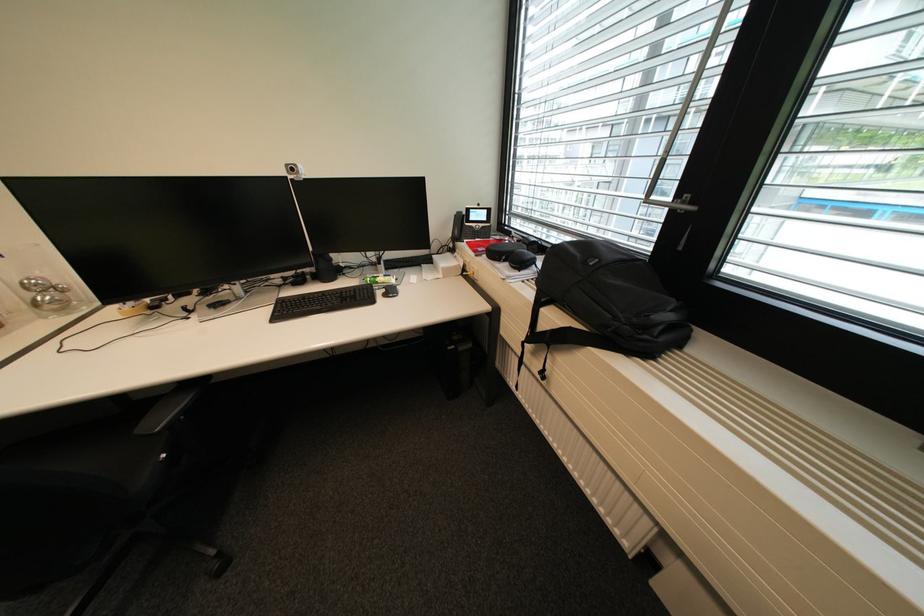
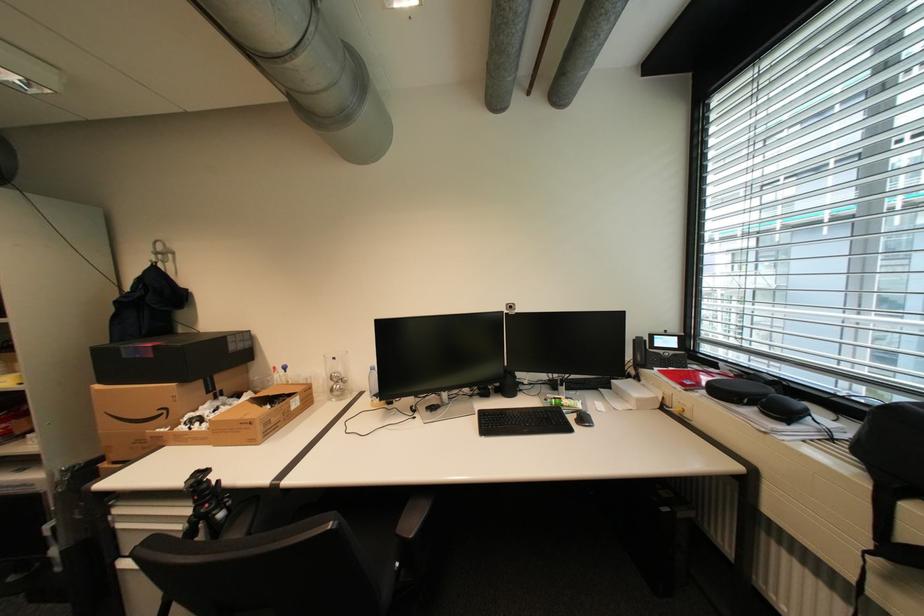
Where in the second image is the point corresponding to (488,249) from the first image?

(695, 383)